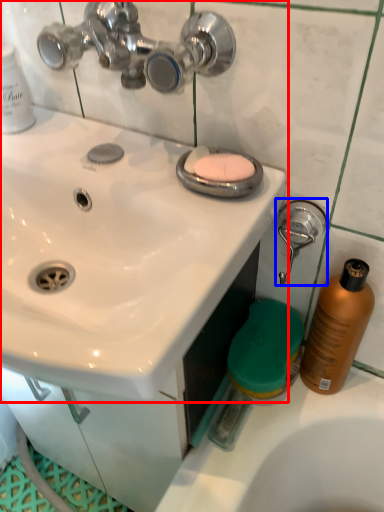
Question: Which object appears closest to the camera in this image, sink (highlighted by a red box) or shower (highlighted by a blue box)?

Choices:
 (A) sink
 (B) shower

Answer: (A)